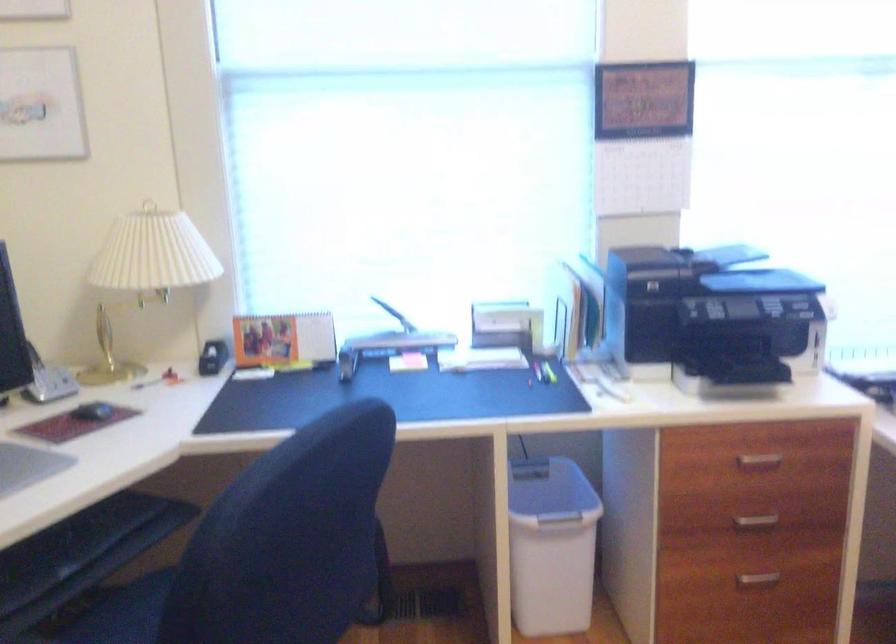
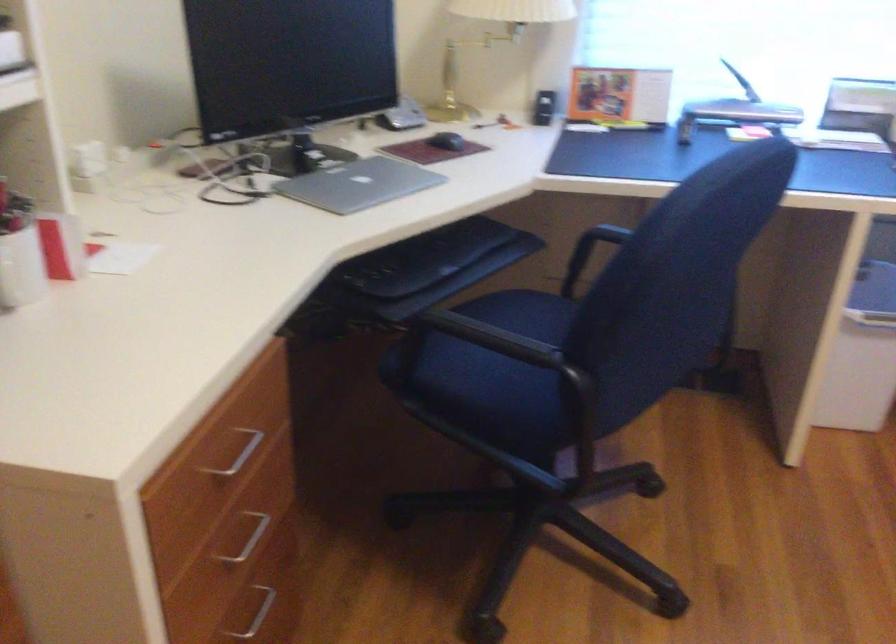
Locate, in the second image, the point that corresponds to [548,562] in the first image.

(862, 355)